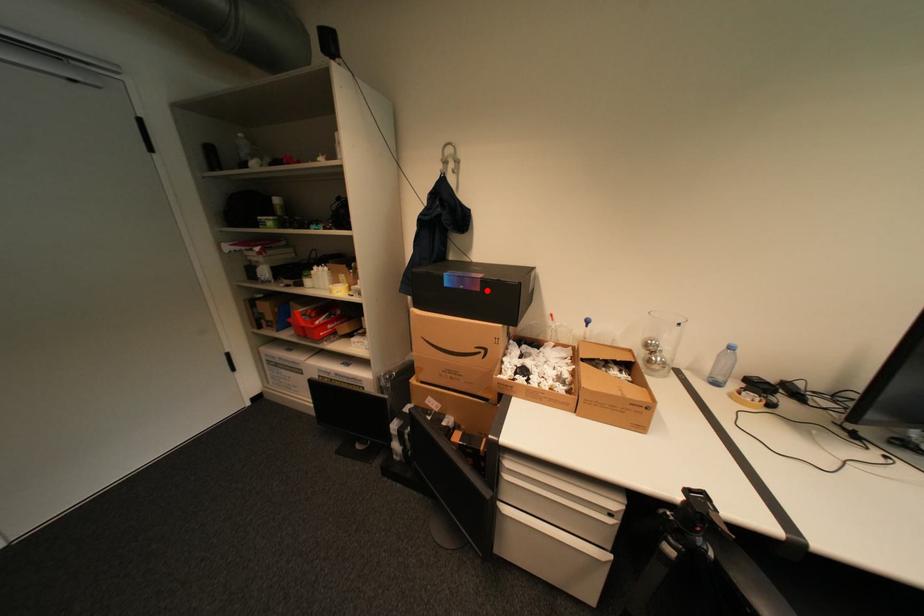
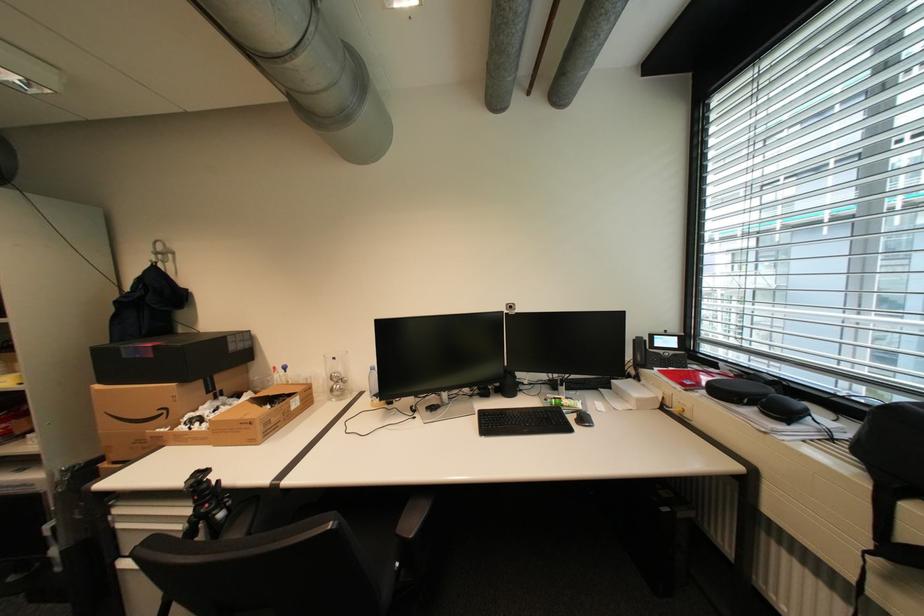
The point at the highlighted location is marked in the first image. Where is the corresponding point in the second image?

(161, 357)